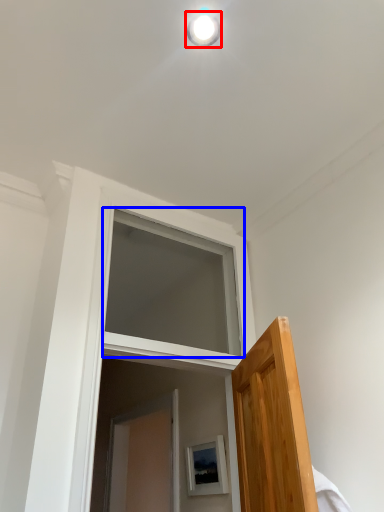
Question: Among these objects, which one is farthest to the camera, light fixture (highlighted by a red box) or window (highlighted by a blue box)?

Choices:
 (A) light fixture
 (B) window

Answer: (B)